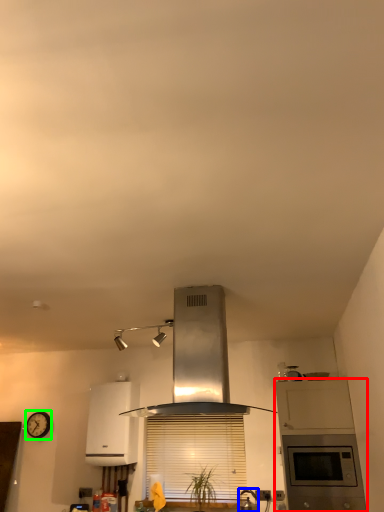
Question: Based on their relative distances, which object is farther from cabinetry (highlighted by a red box)? Choose from kitchen appliance (highlighted by a blue box) and clock (highlighted by a green box).

Choices:
 (A) kitchen appliance
 (B) clock

Answer: (B)